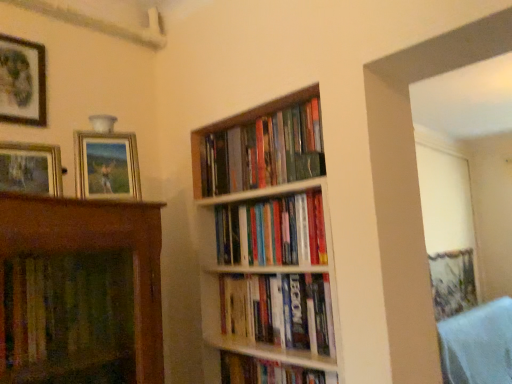
Question: Is point (239, 251) positioned closer to the camera than point (243, 306)?

Choices:
 (A) farther
 (B) closer

Answer: (A)

Question: From a real-world perspective, is hardcover books at center, positioned as the third book in bottom-to-top order, physically located above or below hardcover books at center, the second book positioned from the bottom?

Choices:
 (A) below
 (B) above

Answer: (B)

Question: Which of these objects is positioned farthest from the matte black picture frame at upper left, which is the 1th picture frame in left-to-right order?

Choices:
 (A) hardcover books at center, positioned as the third book in bottom-to-top order
 (B) hardcover books at center, arranged as the 1th book when viewed from the top
 (C) wooden picture frame at upper left, which ranks as the 1th picture frame in right-to-left order
 (D) wooden bookshelf at center
 (E) hardcover book at center, marked as the fourth book in a top-to-bottom arrangement

Answer: (E)

Question: Estimate the real-world distances between objects in this image. Which object is closer to the matte black picture frame at upper left, which is the 1th picture frame in left-to-right order?

Choices:
 (A) hardcover books at center, the 3th book from the top
 (B) wooden bookshelf at center
 (C) wooden picture frame at upper left, the second picture frame in the back-to-front sequence
 (D) hardcover books at center, which appears as the 4th book when ordered from the bottom
 (E) matte wooden picture frame at left, which ranks as the second picture frame in left-to-right order

Answer: (E)